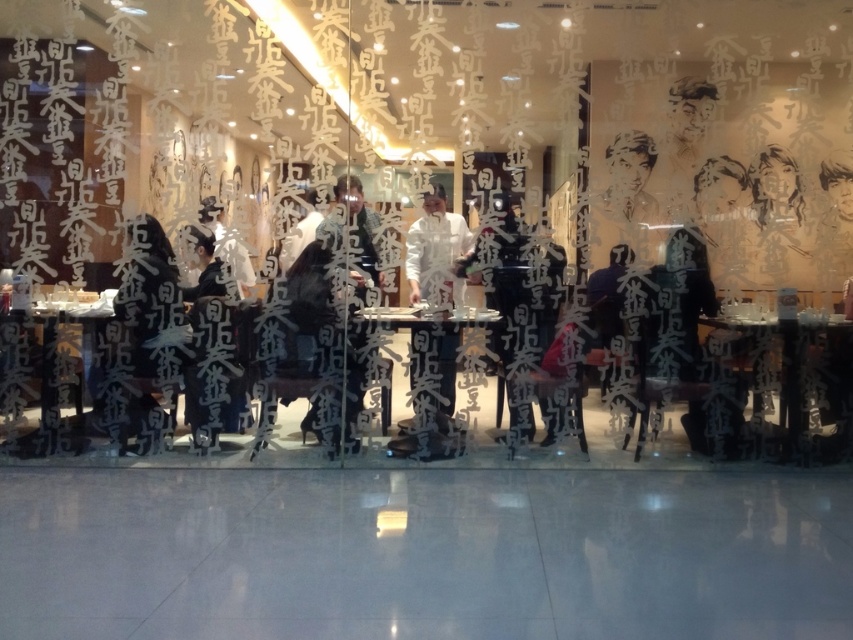
Based on the photo, can you confirm if transparent glass table at lower right is taller than matte black shirt at center?

No.

Between transparent glass table at lower right and matte black shirt at center, which one appears on the left side from the viewer's perspective?

From the viewer's perspective, matte black shirt at center appears more on the left side.

Between point (799, 419) and point (341, 204), which one is positioned in front?

Positioned in front is point (799, 419).

Where is `transparent glass table at lower right`? transparent glass table at lower right is located at coordinates (788, 378).

Which is more to the left, transparent glass table at lower right or metallic silver table at center?

metallic silver table at center is more to the left.

Who is shorter, transparent glass table at lower right or metallic silver table at center?

With less height is metallic silver table at center.

The image size is (853, 640). What do you see at coordinates (788, 378) in the screenshot? I see `transparent glass table at lower right` at bounding box center [788, 378].

Find the location of a particular element. This screenshot has width=853, height=640. transparent glass table at lower right is located at coordinates (788, 378).

Can you confirm if black matte jacket at left is bigger than matte black shirt at center?

Yes, black matte jacket at left is bigger than matte black shirt at center.

The width and height of the screenshot is (853, 640). What do you see at coordinates (148, 328) in the screenshot? I see `black matte jacket at left` at bounding box center [148, 328].

Where is `black matte jacket at left`? This screenshot has height=640, width=853. black matte jacket at left is located at coordinates (148, 328).